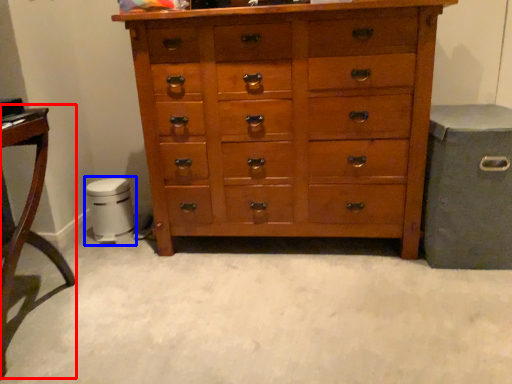
Question: Which of the following is the farthest to the observer, table (highlighted by a red box) or music stool (highlighted by a blue box)?

Choices:
 (A) table
 (B) music stool

Answer: (B)